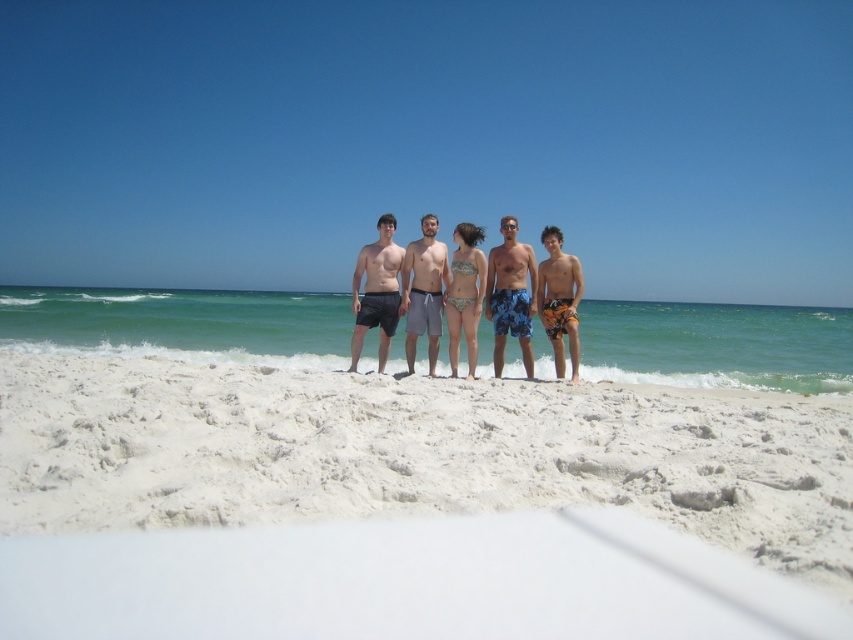
Question: Can you confirm if white sandy beach at center is positioned to the left of gray fabric shorts at center?

Choices:
 (A) yes
 (B) no

Answer: (A)

Question: Which point appears closest to the camera in this image?

Choices:
 (A) (525, 305)
 (B) (434, 488)

Answer: (B)

Question: Considering the real-world distances, which object is closest to the white sandy beach at center?

Choices:
 (A) multicolored swim trunks at center
 (B) printed bikini at center

Answer: (B)

Question: Can you confirm if white sandy beach at center is positioned to the right of printed bikini at center?

Choices:
 (A) yes
 (B) no

Answer: (B)

Question: Among these objects, which one is nearest to the camera?

Choices:
 (A) printed bikini at center
 (B) white sandy beach at center
 (C) multicolored swim trunks at center

Answer: (B)

Question: Can you confirm if white sandy beach at center is positioned to the right of blue printed shorts at center?

Choices:
 (A) no
 (B) yes

Answer: (A)